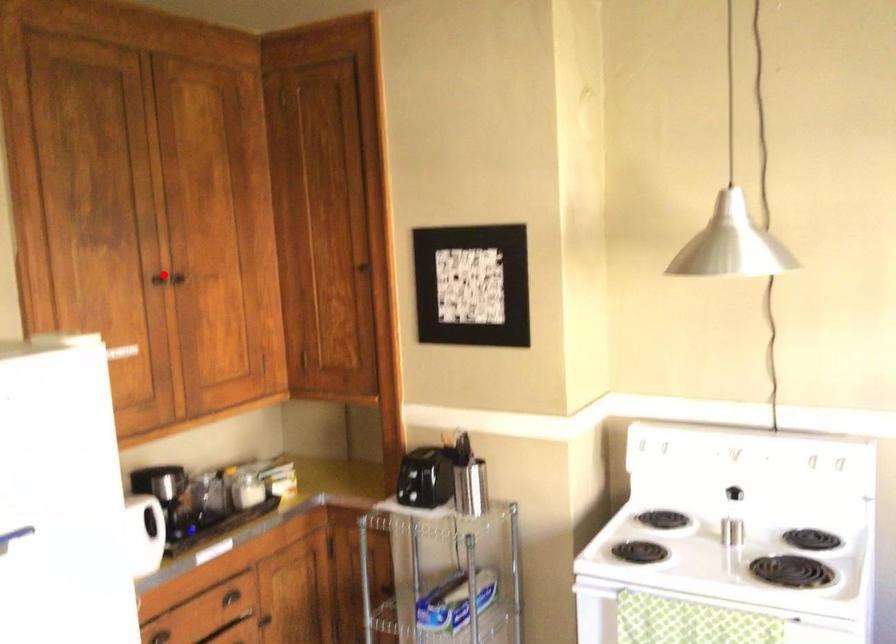
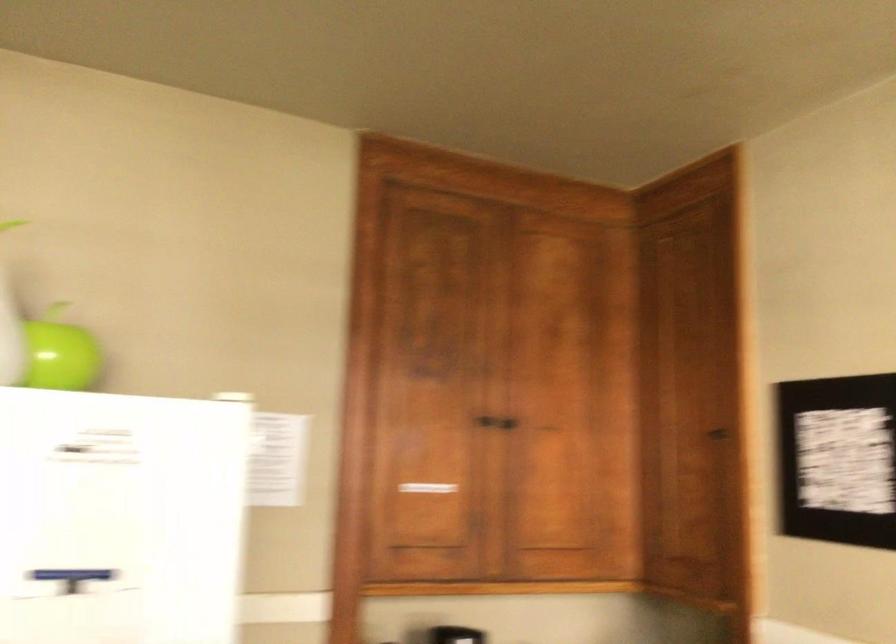
In the second image, find the point that corresponds to the highlighted location in the first image.

(485, 420)